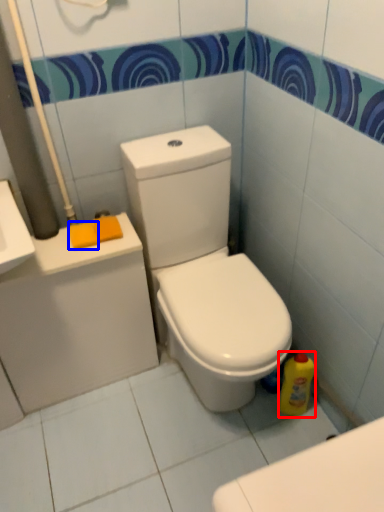
Question: Which object appears closest to the camera in this image, cleaning product (highlighted by a red box) or soap (highlighted by a blue box)?

Choices:
 (A) cleaning product
 (B) soap

Answer: (B)